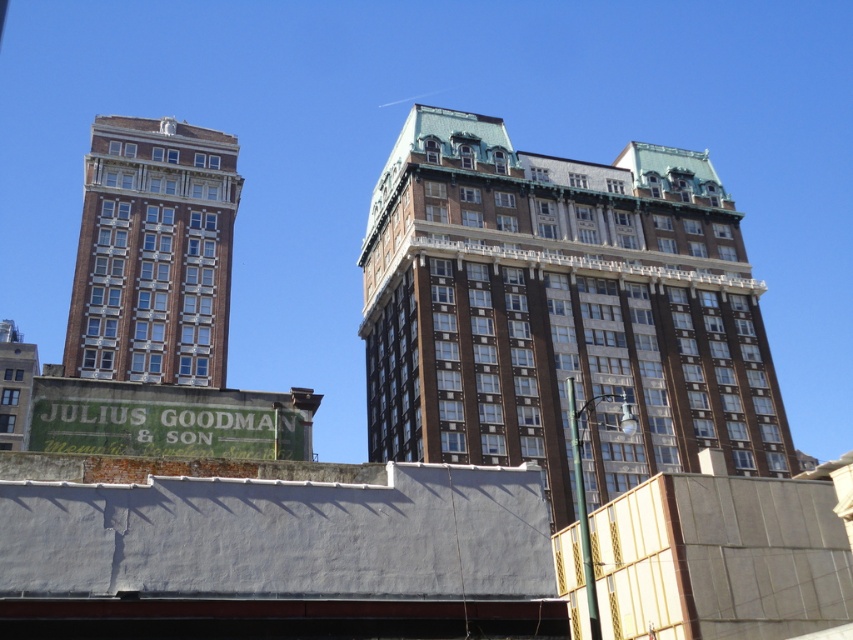
Question: Can you confirm if brown brick building at center is wider than brown brick building at left?

Choices:
 (A) no
 (B) yes

Answer: (B)

Question: Is brown brick building at center to the left of brown brick building at left from the viewer's perspective?

Choices:
 (A) no
 (B) yes

Answer: (A)

Question: Which point appears closest to the camera in this image?

Choices:
 (A) (397, 381)
 (B) (199, 353)

Answer: (B)

Question: Does brown brick building at center appear over brown brick building at left?

Choices:
 (A) no
 (B) yes

Answer: (A)